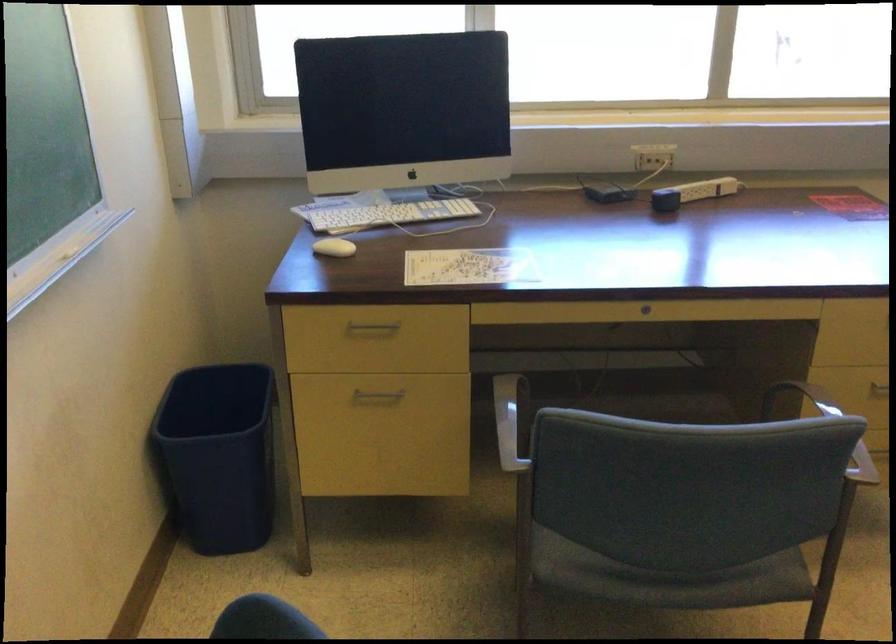
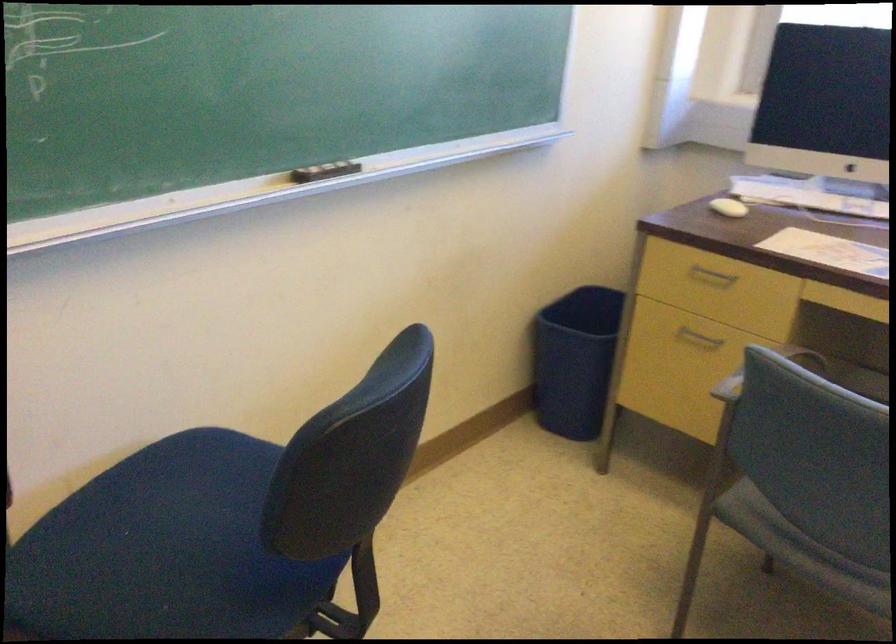
Question: The camera is either moving clockwise (left) or counter-clockwise (right) around the object. The first image is from the beginning of the video and the second image is from the end. Is the camera moving left or right when shooting the video?

Choices:
 (A) Left
 (B) Right

Answer: (B)